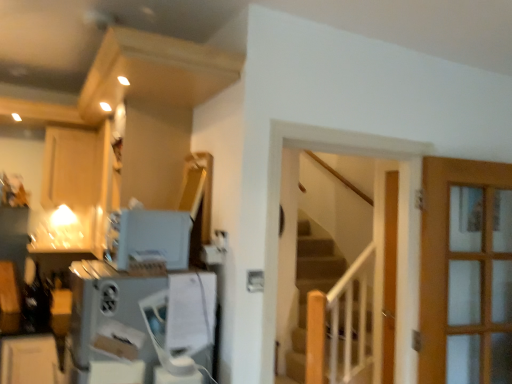
Question: In which direction should I rotate to look at satin white toaster at upper center, arranged as the 1th appliance when viewed from the top?

Choices:
 (A) right
 (B) left

Answer: (B)

Question: Does satin silver appliance at lower left, the 1th appliance from the bottom, come behind wooden stairs at center?

Choices:
 (A) yes
 (B) no

Answer: (B)

Question: Can we say satin silver appliance at lower left, which appears as the second appliance when viewed from the top, lies outside wooden stairs at center?

Choices:
 (A) no
 (B) yes

Answer: (B)

Question: Are satin silver appliance at lower left, the 1th appliance from the bottom, and wooden stairs at center far apart?

Choices:
 (A) no
 (B) yes

Answer: (B)

Question: Is wooden stairs at center completely or partially inside satin silver appliance at lower left, which appears as the second appliance when viewed from the top?

Choices:
 (A) no
 (B) yes

Answer: (A)

Question: Is satin silver appliance at lower left, which appears as the second appliance when viewed from the top, thinner than wooden stairs at center?

Choices:
 (A) yes
 (B) no

Answer: (B)

Question: Considering the relative sizes of satin silver appliance at lower left, the 1th appliance from the bottom, and wooden stairs at center in the image provided, is satin silver appliance at lower left, the 1th appliance from the bottom, wider than wooden stairs at center?

Choices:
 (A) yes
 (B) no

Answer: (A)

Question: Are satin silver appliance at lower left, which appears as the second appliance when viewed from the top, and matte wood cabinet at upper left located far from each other?

Choices:
 (A) no
 (B) yes

Answer: (B)

Question: From the image's perspective, does satin silver appliance at lower left, the 1th appliance from the bottom, appear lower than matte wood cabinet at upper left?

Choices:
 (A) no
 (B) yes

Answer: (B)

Question: Does satin silver appliance at lower left, which appears as the second appliance when viewed from the top, turn towards matte wood cabinet at upper left?

Choices:
 (A) yes
 (B) no

Answer: (B)

Question: From the image's perspective, would you say satin silver appliance at lower left, which appears as the second appliance when viewed from the top, is positioned over matte wood cabinet at upper left?

Choices:
 (A) yes
 (B) no

Answer: (B)

Question: Considering the relative sizes of satin silver appliance at lower left, the 1th appliance from the bottom, and matte wood cabinet at upper left in the image provided, is satin silver appliance at lower left, the 1th appliance from the bottom, wider than matte wood cabinet at upper left?

Choices:
 (A) no
 (B) yes

Answer: (B)

Question: Is satin silver appliance at lower left, which appears as the second appliance when viewed from the top, to the left of matte wood cabinet at upper left from the viewer's perspective?

Choices:
 (A) yes
 (B) no

Answer: (B)

Question: Is the depth of matte wood cabinet at upper left less than that of wooden stairs at center?

Choices:
 (A) yes
 (B) no

Answer: (A)